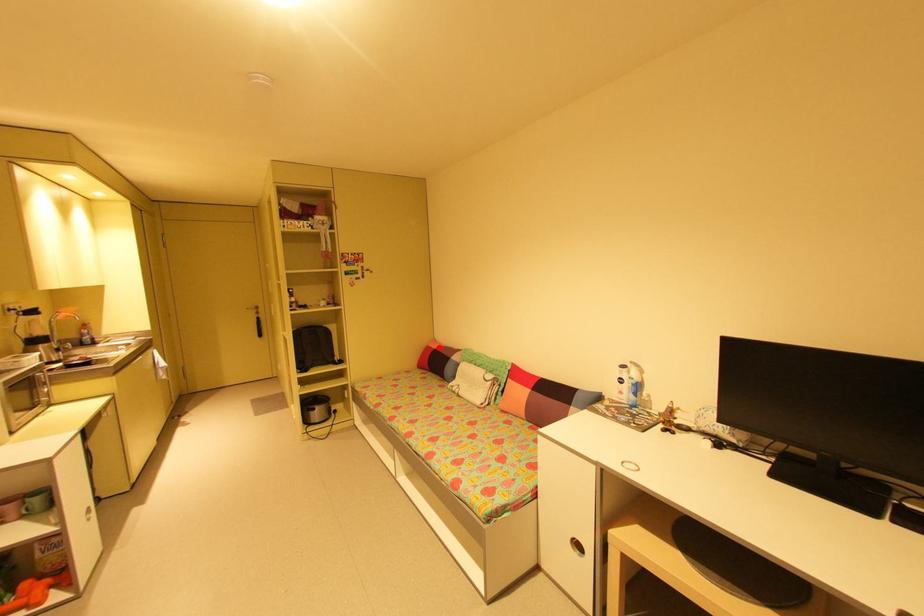
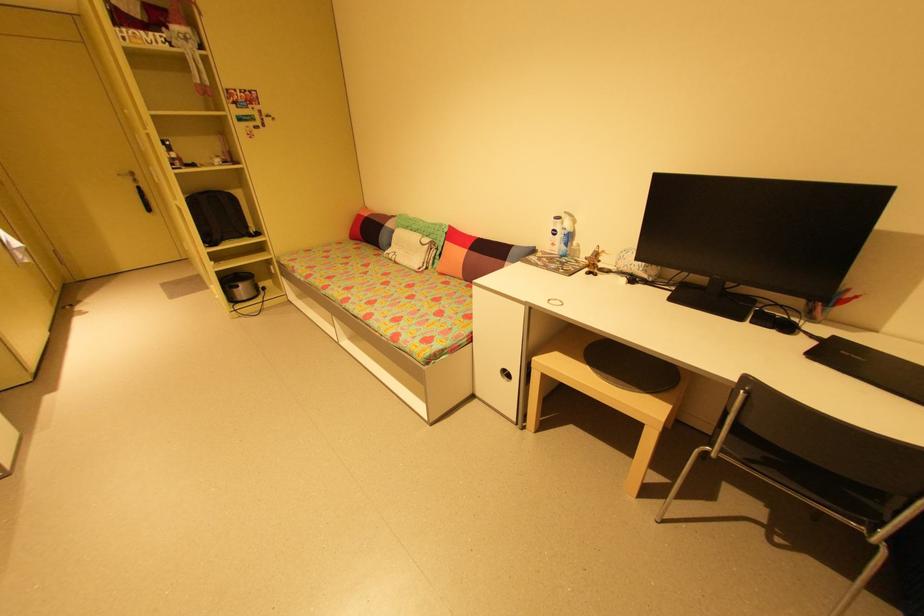
Where in the second image is the point corresponding to the highlighted location from the first image?

(371, 215)